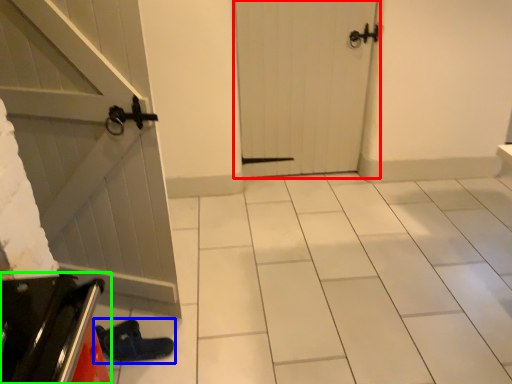
Question: Considering the real-world distances, which object is farthest from door (highlighted by a red box)? footwear (highlighted by a blue box) or appliance (highlighted by a green box)?

Choices:
 (A) footwear
 (B) appliance

Answer: (B)